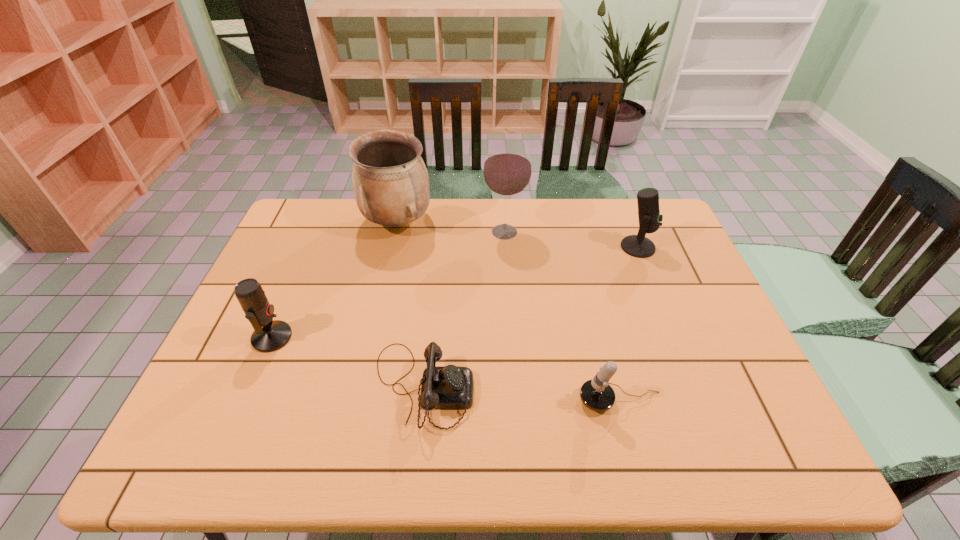
Locate an element on the screen. object that is at the right edge is located at coordinates (650, 220).

This screenshot has height=540, width=960. What are the coordinates of `object located in the far right corner section of the desktop` in the screenshot? It's located at (650, 220).

Locate an element on the screen. The image size is (960, 540). blank space at the far edge of the desktop is located at coordinates (x=358, y=213).

Find the location of a particular element. blank space at the left edge is located at coordinates pos(254,360).

This screenshot has width=960, height=540. What are the coordinates of `free space at the far left corner of the desktop` in the screenshot? It's located at (325, 200).

At what (x,y) coordinates should I click in order to perform the action: click on vacant space at the near left corner of the desktop. Please return your answer as a coordinate pair (x, y). Looking at the image, I should click on (187, 438).

In the image, there is a desktop. In order to click on free space at the far right corner in this screenshot , I will do `click(632, 212)`.

Identify the location of empty space that is in between the telephone and the leftmost microphone. (348, 362).

Image resolution: width=960 pixels, height=540 pixels. What are the coordinates of `unoccupied position between the shortest object and the alcohol` in the screenshot? It's located at (464, 309).

The height and width of the screenshot is (540, 960). In order to click on free area in between the nearest microphone and the urn in this screenshot , I will do `click(509, 312)`.